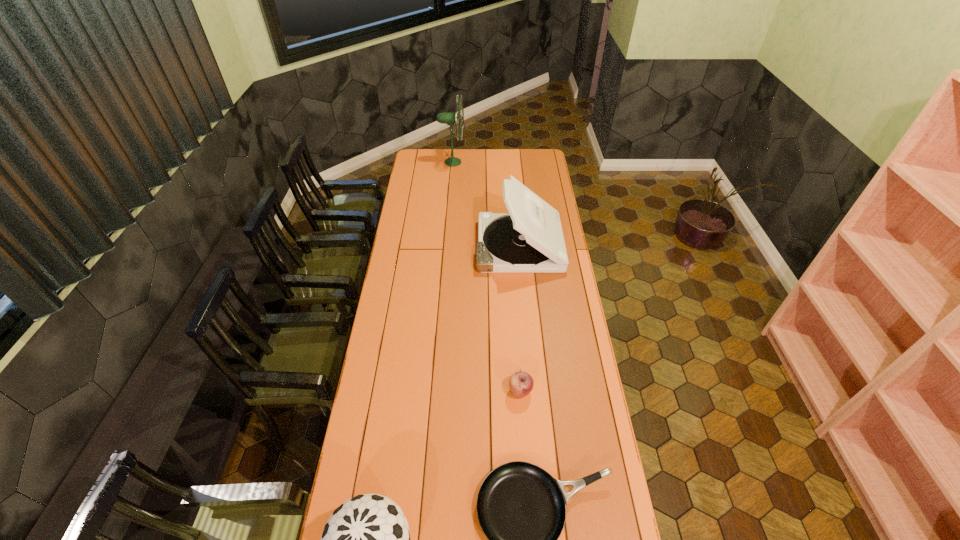
Locate which object is the closest to the shortest object. Please provide its 2D coordinates. Your answer should be formatted as a tuple, i.e. [(x, y)], where the tuple contains the x and y coordinates of a point satisfying the conditions above.

[(366, 539)]

You are a GUI agent. You are given a task and a screenshot of the screen. Output one action in this format:
    pyautogui.click(x=<x>, y=<y>)
    Task: Click on the blank space that satisfies the following two spatial constraints: 1. on the front-facing side of the fourth tallest object; 2. on the left side of the farthest object
    
    Given the screenshot: What is the action you would take?
    pyautogui.click(x=434, y=391)

Find the location of `blank area in the image that satisfies the following two spatial constraints: 1. on the front-facing side of the fourth tallest object; 2. on the left side of the farthest object`. blank area in the image that satisfies the following two spatial constraints: 1. on the front-facing side of the fourth tallest object; 2. on the left side of the farthest object is located at coordinates (434, 391).